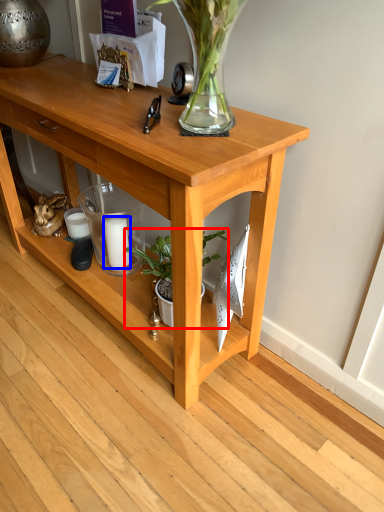
Question: Which of the following is the closest to the observer, houseplant (highlighted by a red box) or candle (highlighted by a blue box)?

Choices:
 (A) houseplant
 (B) candle

Answer: (A)